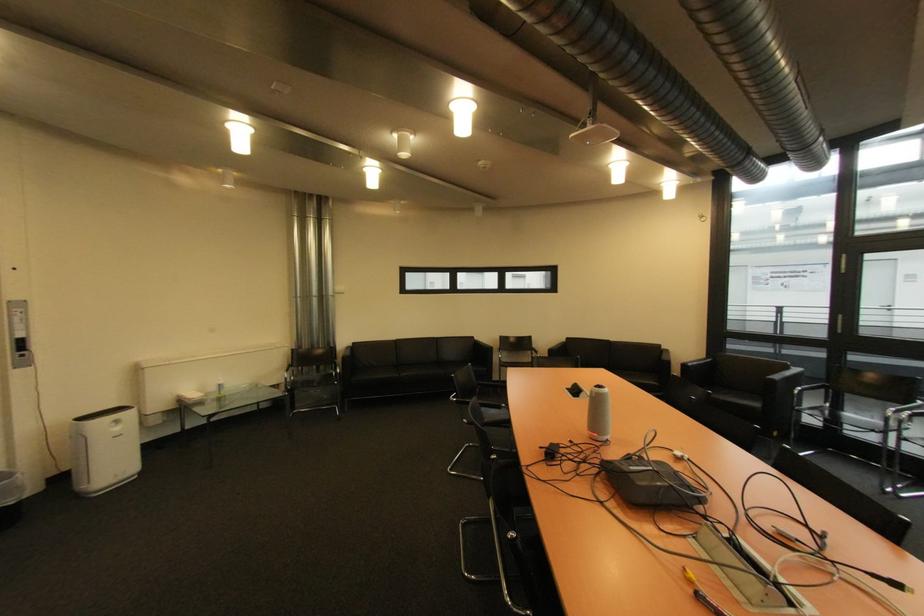
Find where to squeez the clear spray bottle. Please return your answer as a coordinate pair (x, y).

(220, 387)